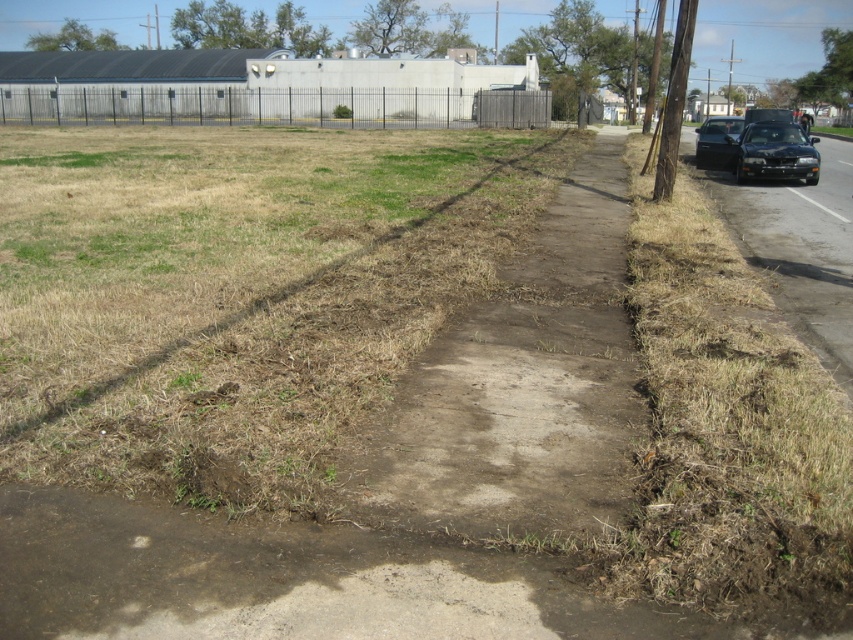
Question: Which of the following is the closest to the observer?

Choices:
 (A) (384, 112)
 (B) (735, 141)

Answer: (B)

Question: Does black metal fence at upper left lie behind black glossy car at right?

Choices:
 (A) no
 (B) yes

Answer: (B)

Question: Which of the following is the closest to the observer?

Choices:
 (A) black metal fence at upper left
 (B) black glossy car at right
 (C) brown dry grass at center

Answer: (C)

Question: Does brown dry grass at center appear on the left side of black glossy car at right?

Choices:
 (A) yes
 (B) no

Answer: (A)

Question: Where is brown dry grass at center located in relation to black glossy car at right in the image?

Choices:
 (A) left
 (B) right

Answer: (A)

Question: Which of the following is the closest to the observer?

Choices:
 (A) black glossy car at right
 (B) black metal fence at upper left
 (C) shiny black sedan at right
 (D) brown dry grass at center

Answer: (D)